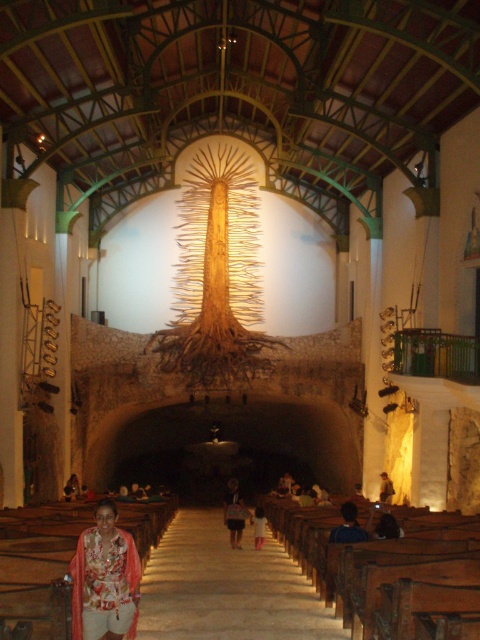
How far apart are dark blue shirt at center and pink fabric at center?

dark blue shirt at center and pink fabric at center are 19.66 meters apart from each other.

Does dark blue shirt at center appear on the left side of pink fabric at center?

In fact, dark blue shirt at center is to the right of pink fabric at center.

Is point (357, 522) farther from camera compared to point (256, 540)?

No, it is not.

Find the location of a particular element. The width and height of the screenshot is (480, 640). dark blue shirt at center is located at coordinates (348, 525).

Who is positioned more to the left, denim jacket at center or pink fabric at center?

denim jacket at center

Which is behind, point (238, 499) or point (264, 525)?

Point (264, 525)

Locate an element on the screen. The width and height of the screenshot is (480, 640). denim jacket at center is located at coordinates (233, 513).

Can you confirm if denim jacket at center is shorter than light brown leather jacket at lower right?

No.

The height and width of the screenshot is (640, 480). What do you see at coordinates (233, 513) in the screenshot? I see `denim jacket at center` at bounding box center [233, 513].

Who is more distant from viewer, (243,506) or (380,496)?

The point (243,506) is behind.

Locate an element on the screen. This screenshot has height=640, width=480. denim jacket at center is located at coordinates point(233,513).